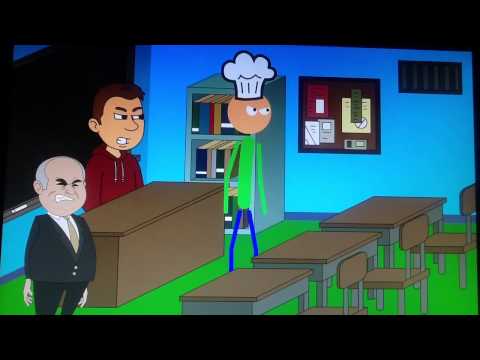
The image size is (480, 360). Identify the location of blackboard. (44, 102).